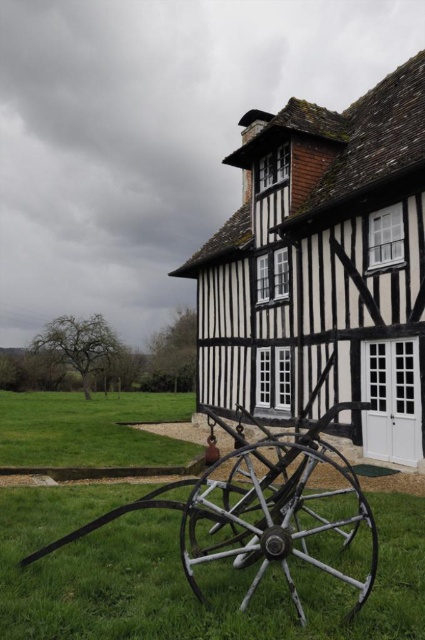
Is green grass at lower center above green grass at lower left?

Yes.

What do you see at coordinates (175, 577) in the screenshot?
I see `green grass at lower center` at bounding box center [175, 577].

Identify the location of green grass at lower center. The width and height of the screenshot is (425, 640). (175, 577).

Identify the location of green grass at lower center. This screenshot has height=640, width=425. (175, 577).

Does point (42, 516) lie in front of point (255, 454)?

No.

Who is more distant from viewer, (x=147, y=570) or (x=227, y=548)?

The point (x=227, y=548) is more distant.

The width and height of the screenshot is (425, 640). Find the location of `green grass at lower center`. green grass at lower center is located at coordinates (175, 577).

Does metallic silver wagon wheel at lower center have a lesser height compared to green grass at lower left?

Yes, metallic silver wagon wheel at lower center is shorter than green grass at lower left.

In the scene shown: Who is shorter, metallic silver wagon wheel at lower center or green grass at lower left?

metallic silver wagon wheel at lower center

Is point (224, 490) more distant than point (13, 449)?

No, it is not.

This screenshot has height=640, width=425. Identify the location of metallic silver wagon wheel at lower center. (282, 522).